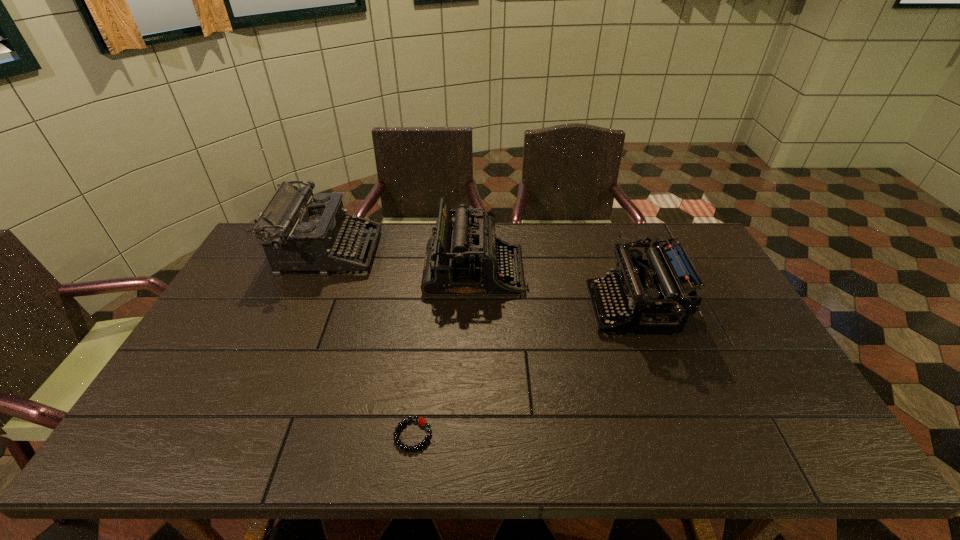
You are a GUI agent. You are given a task and a screenshot of the screen. Output one action in this format:
    pyautogui.click(x=<x>, y=<y>)
    Task: Click on the leftmost typewriter
    
    Given the screenshot: What is the action you would take?
    pyautogui.click(x=304, y=231)

The image size is (960, 540). I want to click on the second typewriter from right to left, so pos(465,258).

The width and height of the screenshot is (960, 540). Identify the location of the rightmost typewriter. (642, 288).

Where is `the shortest object`? Image resolution: width=960 pixels, height=540 pixels. the shortest object is located at coordinates (421, 420).

You are a GUI agent. You are given a task and a screenshot of the screen. Output one action in this format:
    pyautogui.click(x=<x>, y=<y>)
    Task: Click on the bracelet
    This screenshot has height=540, width=960.
    Given the screenshot: What is the action you would take?
    pyautogui.click(x=421, y=420)

Locate an element on the screen. The height and width of the screenshot is (540, 960). free region located 0.330m on the typing side of the leftmost object is located at coordinates (471, 252).

You are a GUI agent. You are given a task and a screenshot of the screen. Output one action in this format:
    pyautogui.click(x=<x>, y=<y>)
    Task: Click on the vacant region located on the keyboard of the second typewriter from left to right
    
    Given the screenshot: What is the action you would take?
    pyautogui.click(x=577, y=272)

Locate an element on the screen. vacant space positioned 0.100m on the keyboard of the rightmost typewriter is located at coordinates (557, 309).

Locate an element on the screen. Image resolution: width=960 pixels, height=540 pixels. free location located on the keyboard of the rightmost typewriter is located at coordinates (511, 309).

You are a GUI agent. You are given a task and a screenshot of the screen. Output one action in this format:
    pyautogui.click(x=<x>, y=<y>)
    Task: Click on the free spot located 0.370m on the keyboard of the rightmost typewriter
    
    Given the screenshot: What is the action you would take?
    pyautogui.click(x=468, y=309)